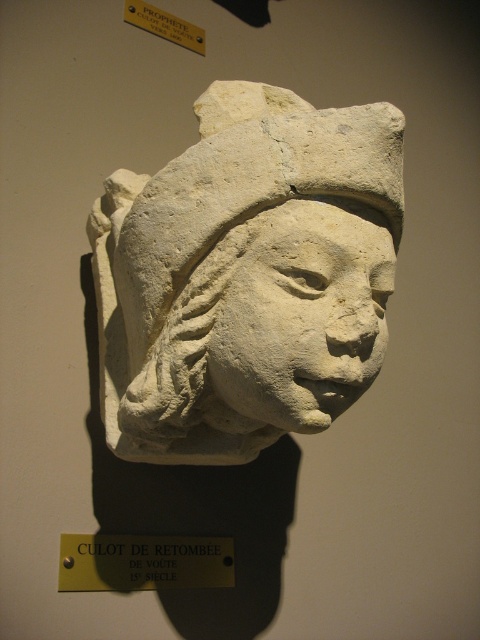
Can you confirm if white stone head at center is smaller than white stone face at center?

Incorrect, white stone head at center is not smaller in size than white stone face at center.

Which is in front, point (176, 460) or point (215, 385)?

Point (215, 385) is in front.

At what (x,y) coordinates should I click in order to perform the action: click on white stone head at center. Please return your answer as a coordinate pair (x, y). Looking at the image, I should click on (247, 276).

Does point (360, 355) come farther from viewer compared to point (120, 561)?

No, it is in front of (120, 561).

Is white stone head at center to the left of gold/yellow metal plaque at center from the viewer's perspective?

No, white stone head at center is not to the left of gold/yellow metal plaque at center.

At what (x,y) coordinates should I click in order to perform the action: click on white stone head at center. Please return your answer as a coordinate pair (x, y). Image resolution: width=480 pixels, height=640 pixels. Looking at the image, I should click on (247, 276).

Between point (326, 218) and point (103, 544), which one is positioned in front?

Point (326, 218)

Measure the distance between white stone face at center and camera.

white stone face at center is 1.59 meters away from camera.

The height and width of the screenshot is (640, 480). What are the coordinates of `white stone face at center` in the screenshot? It's located at pyautogui.click(x=302, y=316).